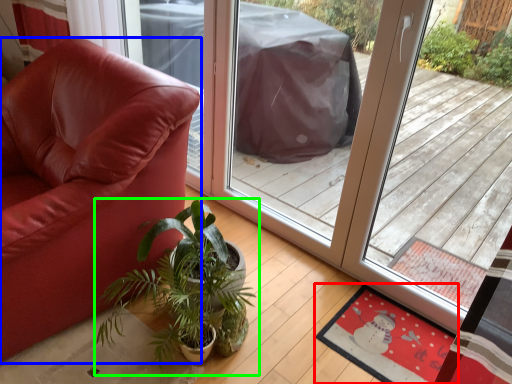
Question: Which object is the farthest from mat (highlighted by a red box)? Choose among these: chair (highlighted by a blue box) or houseplant (highlighted by a green box).

Choices:
 (A) chair
 (B) houseplant

Answer: (A)